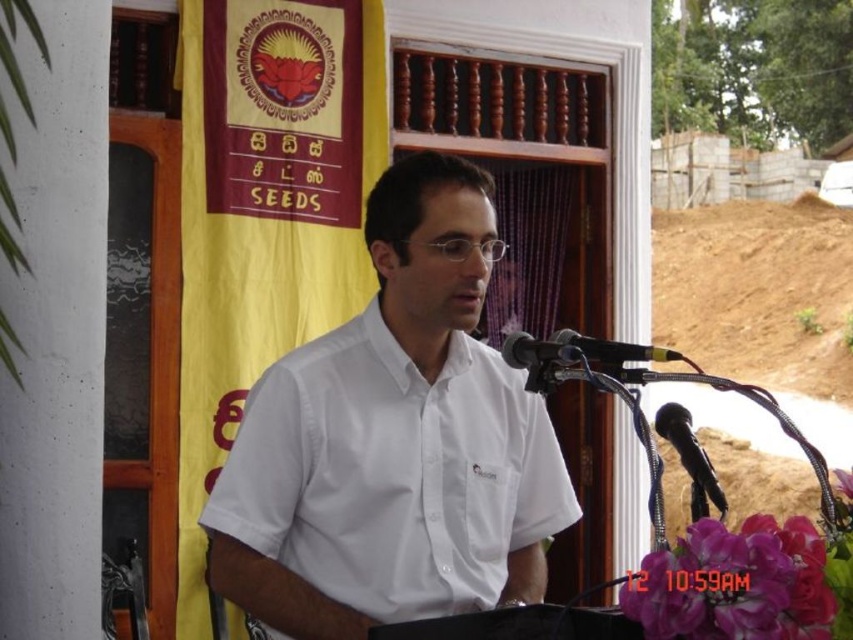
Which is behind, point (401, 468) or point (592, 355)?

Point (401, 468)

Image resolution: width=853 pixels, height=640 pixels. I want to click on white smooth shirt at center, so click(x=393, y=440).

Is black plastic microphone at lower right wider than black metallic microphone at center?

Yes, black plastic microphone at lower right is wider than black metallic microphone at center.

You are a GUI agent. You are given a task and a screenshot of the screen. Output one action in this format:
    pyautogui.click(x=<x>, y=<y>)
    Task: Click on the black plastic microphone at lower right
    
    Given the screenshot: What is the action you would take?
    pyautogui.click(x=689, y=460)

Identify the location of black plastic microphone at lower right. The image size is (853, 640). (689, 460).

Does white smooth shirt at center have a lesser width compared to black metallic microphone at center?

Incorrect, white smooth shirt at center's width is not less than black metallic microphone at center's.

Between point (553, 513) and point (532, 339), which one is positioned behind?

The point (532, 339) is behind.

What are the coordinates of `white smooth shirt at center` in the screenshot? It's located at (393, 440).